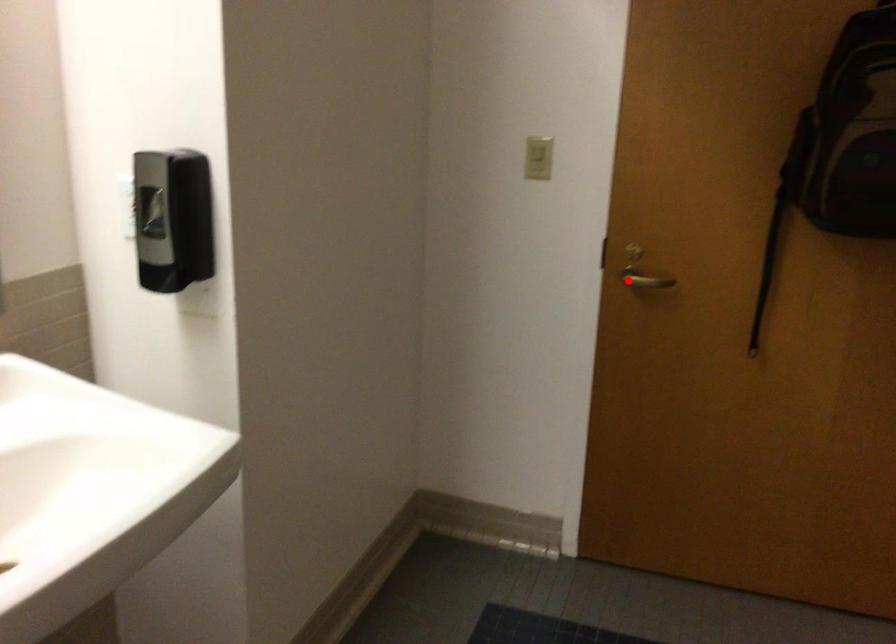
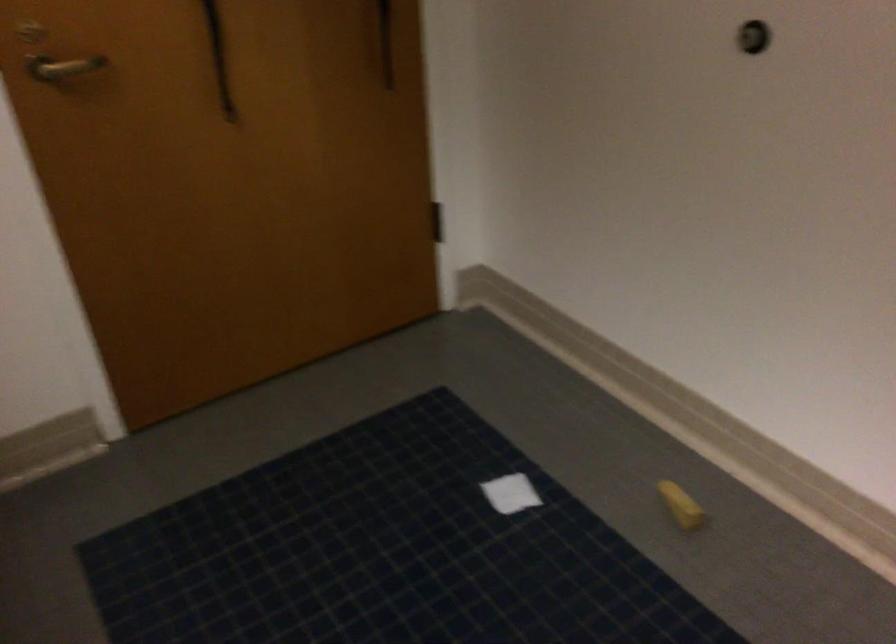
Question: I am providing you with two images of the same scene from different viewpoints. A red point is shown in image1. For the corresponding object point in image2, is it positioned nearer or farther from the camera?

Choices:
 (A) Nearer
 (B) Farther

Answer: (A)